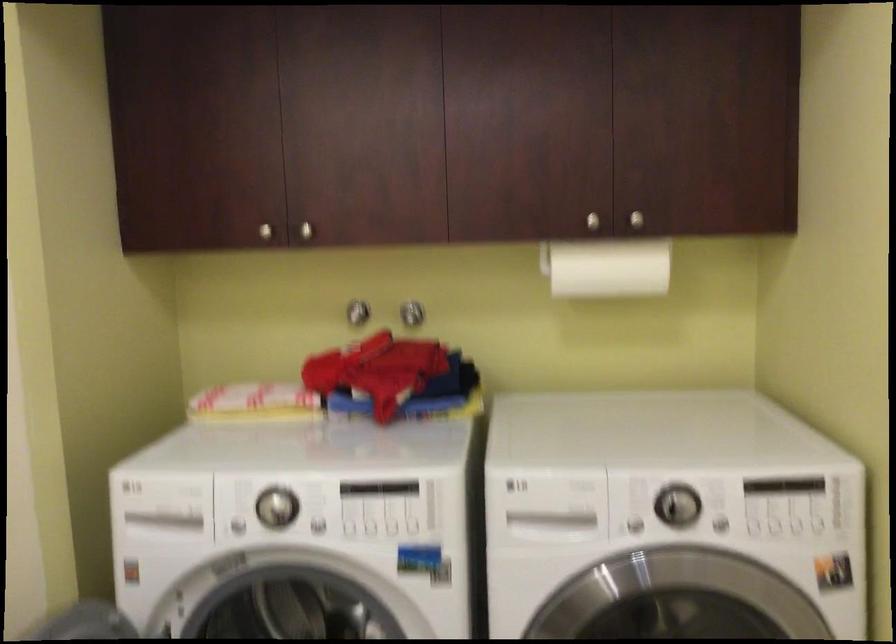
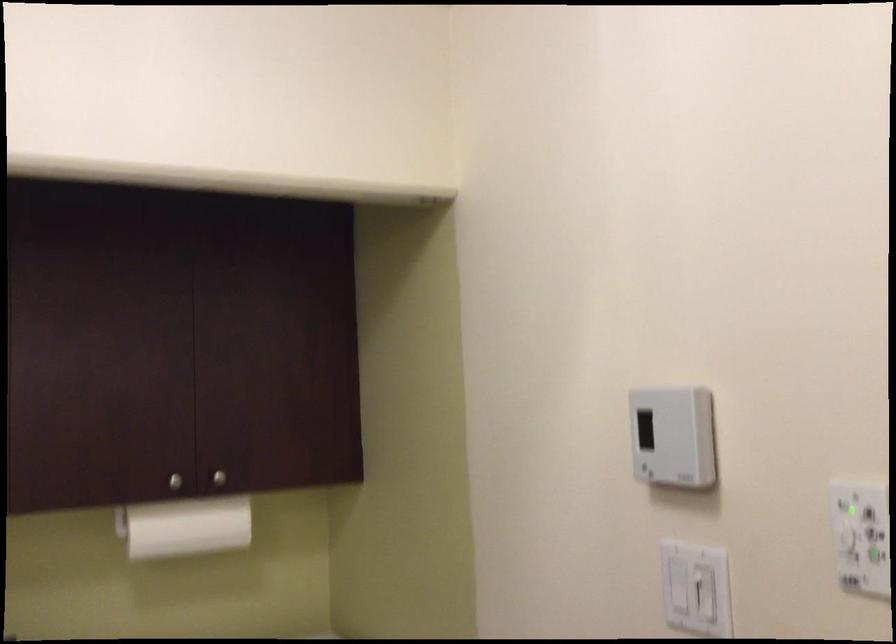
Find the pixel in the second image that matches (595,218) in the first image.

(175, 482)